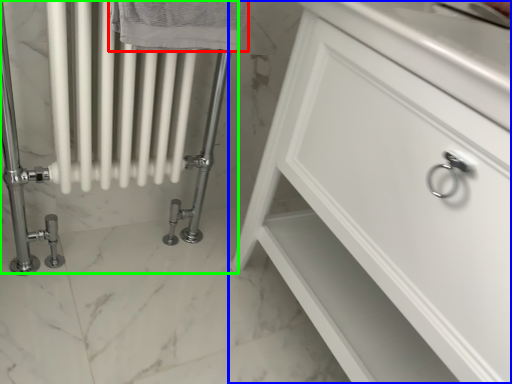
Question: Based on their relative distances, which object is nearer to bath towel (highlighted by a red box)? Choose from bathroom cabinet (highlighted by a blue box) and bath (highlighted by a green box).

Choices:
 (A) bathroom cabinet
 (B) bath

Answer: (B)